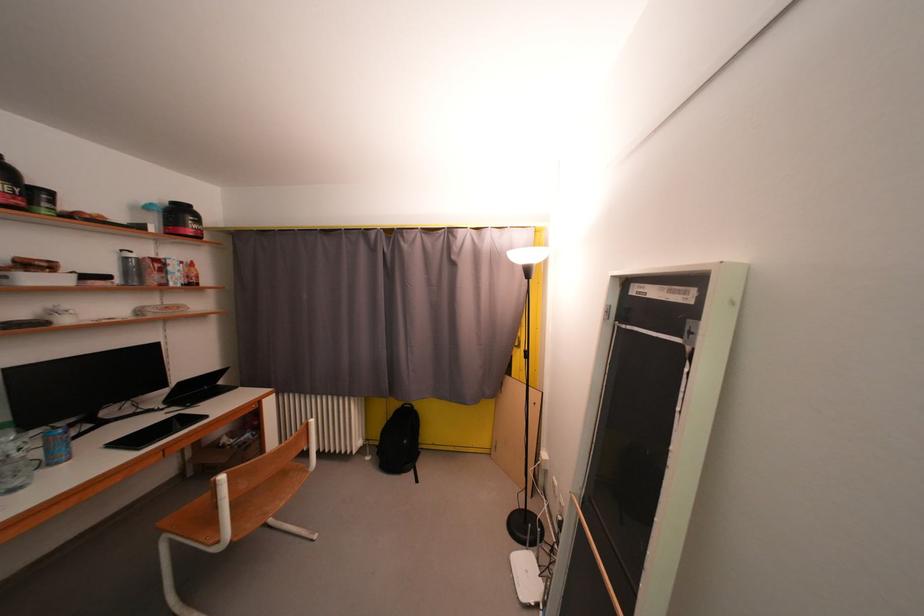
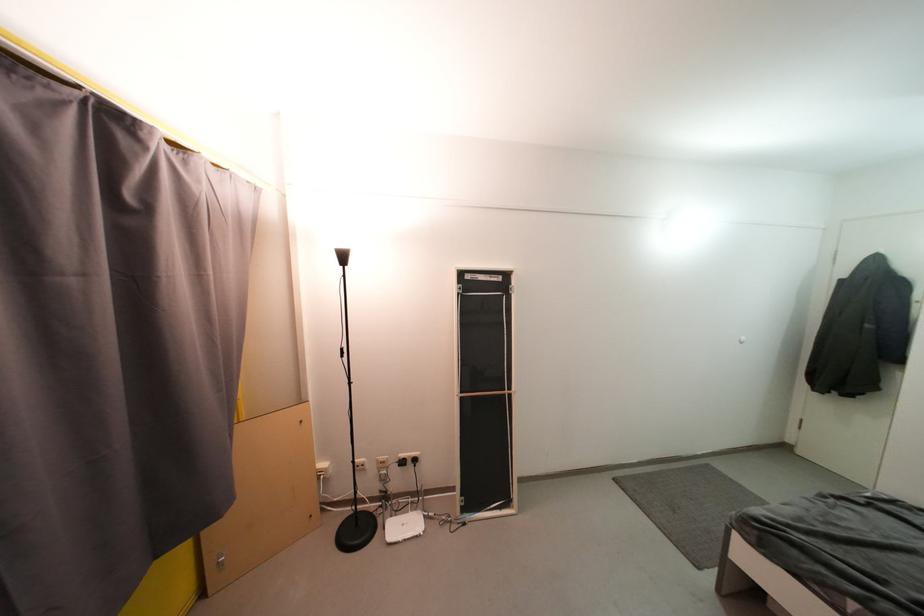
In the second image, find the point that corresponds to [487,238] in the first image.

(192, 166)